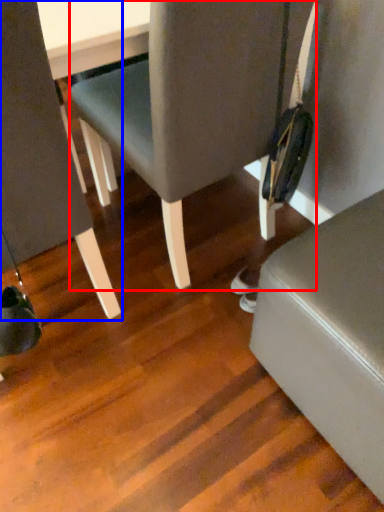
Question: Which point is further to the camera, chair (highlighted by a red box) or chair (highlighted by a blue box)?

Choices:
 (A) chair
 (B) chair

Answer: (A)